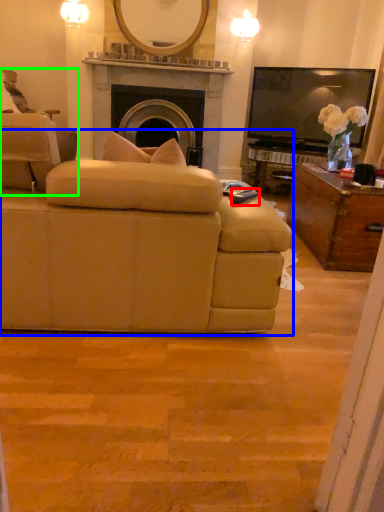
Question: Estimate the real-world distances between objects in this image. Which object is farther from remote control (highlighted by a red box), studio couch (highlighted by a blue box) or chair (highlighted by a green box)?

Choices:
 (A) studio couch
 (B) chair

Answer: (B)